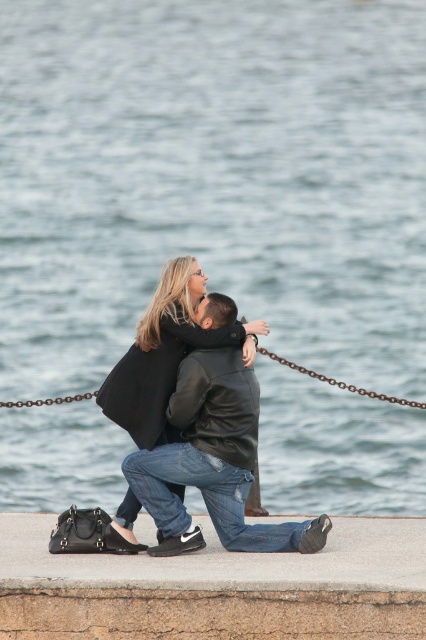
Question: Among these objects, which one is nearest to the camera?

Choices:
 (A) black leather jacket at center
 (B) concrete at lower center

Answer: (B)

Question: Is concrete at lower center bigger than black leather jacket at center?

Choices:
 (A) yes
 (B) no

Answer: (A)

Question: Does concrete at lower center have a smaller size compared to black leather jacket at center?

Choices:
 (A) no
 (B) yes

Answer: (A)

Question: Which point is closer to the camera taking this photo?

Choices:
 (A) (236, 525)
 (B) (106, 556)

Answer: (B)

Question: Is concrete at lower center to the left of black leather jacket at center from the viewer's perspective?

Choices:
 (A) no
 (B) yes

Answer: (B)